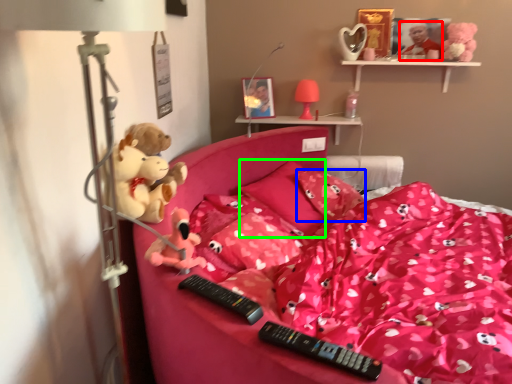
Question: Based on their relative distances, which object is farther from toy (highlighted by a red box)? Choose from pillow (highlighted by a blue box) and pillow (highlighted by a green box).

Choices:
 (A) pillow
 (B) pillow

Answer: (B)